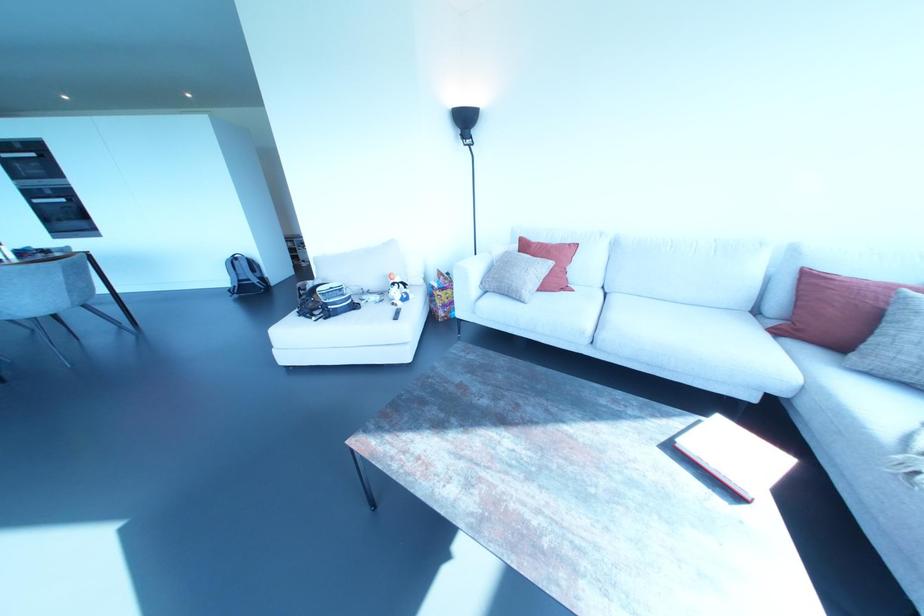
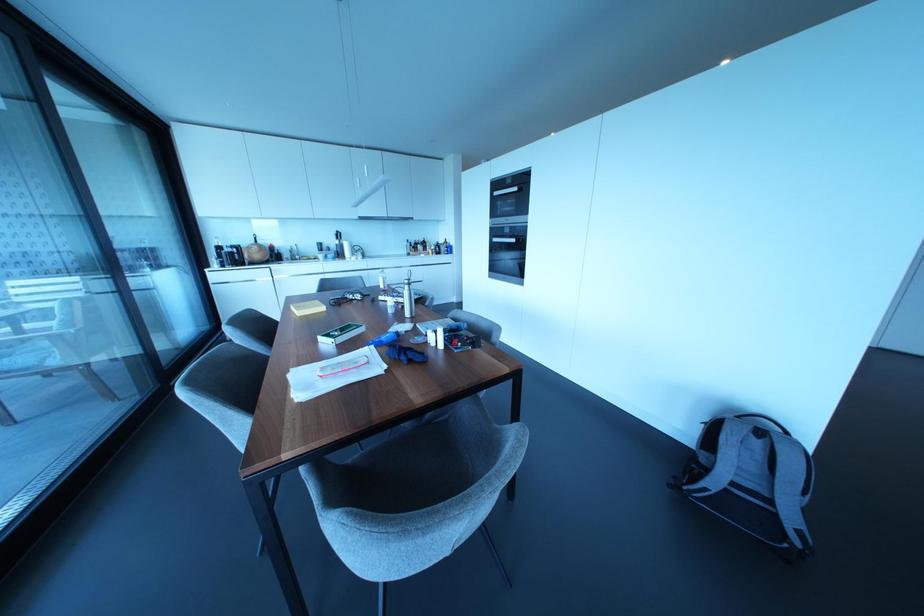
In the second image, find the point that corresponds to point 37,201 in the first image.

(493, 238)